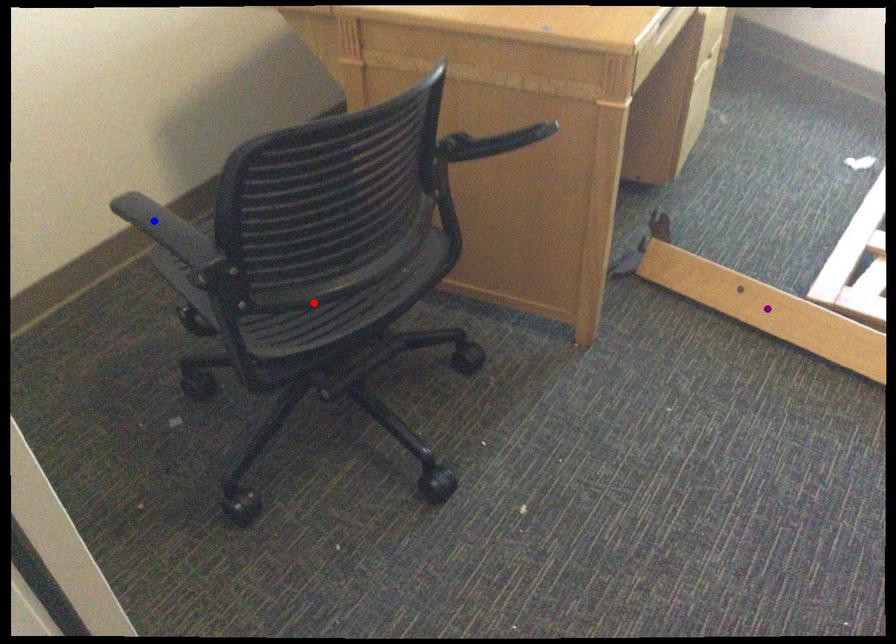
Order these from farthest to nearest:
purple point
red point
blue point

1. blue point
2. purple point
3. red point